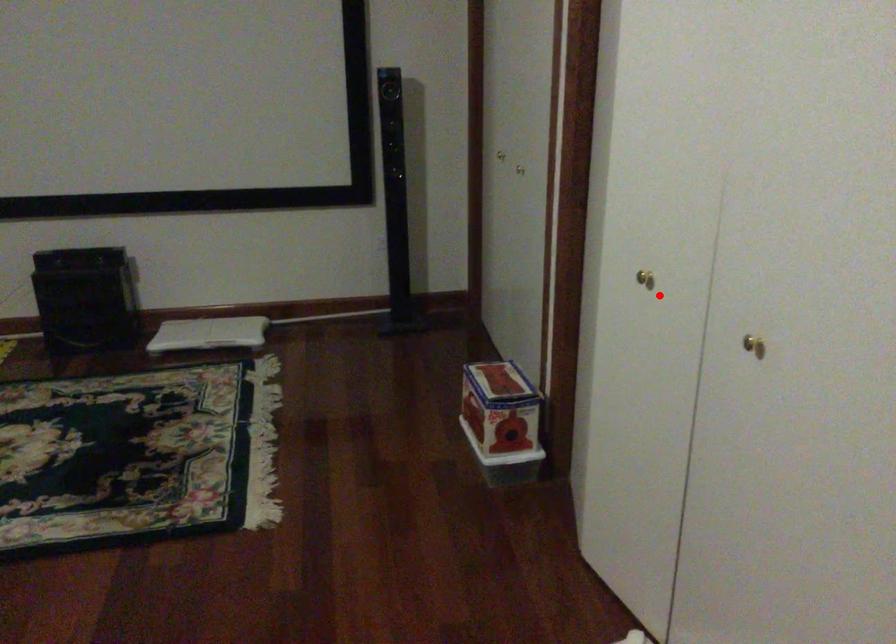
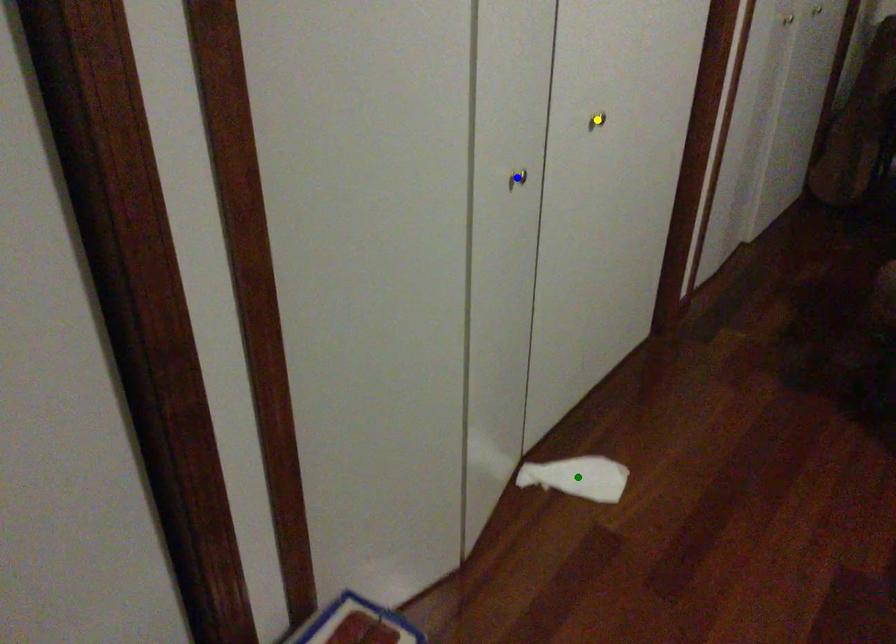
Question: I am providing you with two images of the same scene from different viewpoints. A red point is marked on the first image. You are given multiple points on the second image. Can you choose the point in image 2 that corresponds to the point in image 1?

Choices:
 (A) blue point
 (B) green point
 (C) yellow point

Answer: (A)